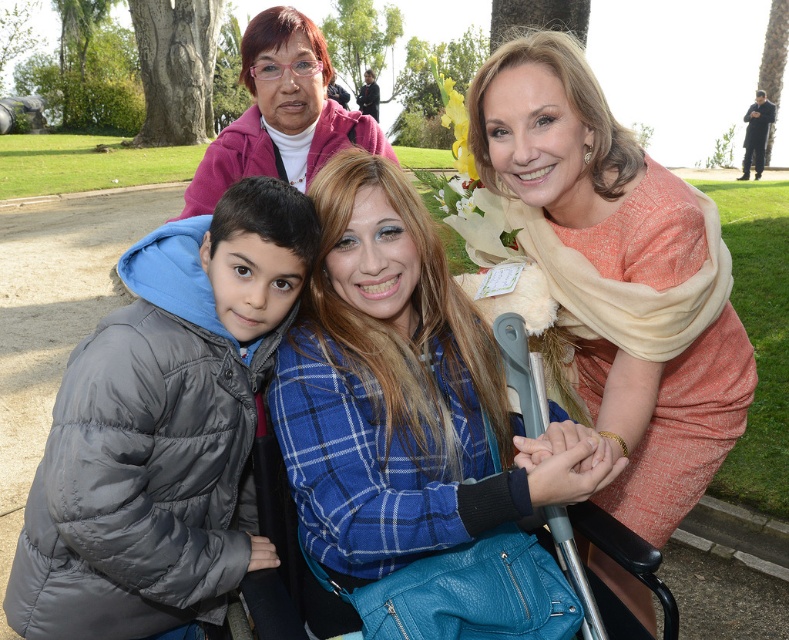
Who is positioned more to the left, gray puffy jacket at center or blue plaid shirt at center?

Positioned to the left is gray puffy jacket at center.

Does gray puffy jacket at center appear over blue plaid shirt at center?

Actually, gray puffy jacket at center is below blue plaid shirt at center.

Is point (204, 602) positioned behind point (356, 180)?

Yes.

The width and height of the screenshot is (789, 640). In order to click on gray puffy jacket at center in this screenshot , I will do tap(163, 429).

Can you confirm if blue plaid shirt at center is bigger than matte orange dress at center?

Incorrect, blue plaid shirt at center is not larger than matte orange dress at center.

Can you confirm if blue plaid shirt at center is positioned below matte orange dress at center?

Incorrect, blue plaid shirt at center is not positioned below matte orange dress at center.

What do you see at coordinates (393, 397) in the screenshot? I see `blue plaid shirt at center` at bounding box center [393, 397].

You are a GUI agent. You are given a task and a screenshot of the screen. Output one action in this format:
    pyautogui.click(x=<x>, y=<y>)
    Task: Click on the blue plaid shirt at center
    This screenshot has width=789, height=640.
    Given the screenshot: What is the action you would take?
    pyautogui.click(x=393, y=397)

Which is in front, point (225, 554) or point (584, 280)?

Positioned in front is point (225, 554).

This screenshot has height=640, width=789. What are the coordinates of `gray puffy jacket at center` in the screenshot? It's located at (163, 429).